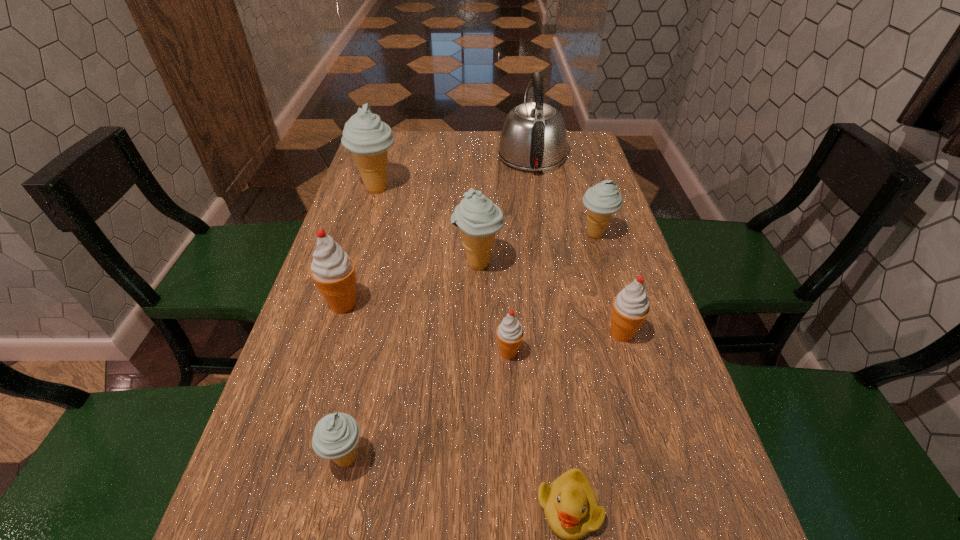
This screenshot has height=540, width=960. I want to click on object located at the far edge, so click(533, 138).

What are the coordinates of `kettle that is at the right edge` in the screenshot? It's located at (533, 138).

You are a GUI agent. You are given a task and a screenshot of the screen. Output one action in this format:
    pyautogui.click(x=<x>, y=<y>)
    Task: Click on the object positioned at the far right corner
    
    Given the screenshot: What is the action you would take?
    pyautogui.click(x=533, y=138)

Where is `vacant position at the left edge of the desktop`? vacant position at the left edge of the desktop is located at coordinates (372, 225).

This screenshot has width=960, height=540. I want to click on vacant space at the right edge of the desktop, so click(x=583, y=237).

Identify the location of free space at the far left corner. (401, 143).

Locate an element on the screen. The height and width of the screenshot is (540, 960). vacant area between the second biggest beige icecream and the second red icecream from right to left is located at coordinates (493, 308).

The height and width of the screenshot is (540, 960). In order to click on vacant space in between the rightmost red icecream and the second red icecream from right to left in this screenshot , I will do `click(565, 343)`.

This screenshot has height=540, width=960. What are the coordinates of `free space between the third farthest object and the gray kettle` in the screenshot? It's located at (564, 195).

Find the location of a particular element. The image size is (960, 540). free point between the fourth nearest icecream and the second smallest red icecream is located at coordinates (483, 319).